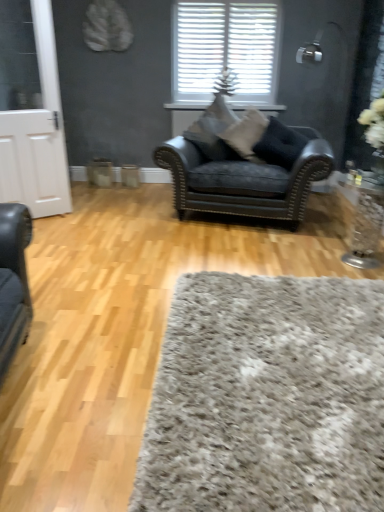
Where is `suede-like gray pillow at center, which is counted as the third pillow, starting from the right`? This screenshot has height=512, width=384. suede-like gray pillow at center, which is counted as the third pillow, starting from the right is located at coordinates (213, 130).

Identify the location of white textured blinds at upper center. The image size is (384, 512). (225, 48).

Identify the location of light brown wood flooring at center. (120, 332).

Locate an element on the screen. The width and height of the screenshot is (384, 512). suede-like gray pillow at center, which is counted as the third pillow, starting from the right is located at coordinates (213, 130).

From a real-world perspective, relative to white textured blinds at upper center, is suede-like beige pillow at center, which ranks as the second pillow in left-to-right order, vertically above or below?

suede-like beige pillow at center, which ranks as the second pillow in left-to-right order, is situated lower than white textured blinds at upper center in the real world.

Image resolution: width=384 pixels, height=512 pixels. In order to click on window to the left of suede-like beige pillow at center, which ranks as the second pillow in left-to-right order in this screenshot , I will do `click(225, 48)`.

Does suede-like beige pillow at center, which ranks as the second pillow in left-to-right order, touch white textured blinds at upper center?

No, suede-like beige pillow at center, which ranks as the second pillow in left-to-right order, is not touching white textured blinds at upper center.

Which of these two, suede-like beige pillow at center, marked as the 2th pillow in a right-to-left arrangement, or white textured blinds at upper center, is wider?

suede-like beige pillow at center, marked as the 2th pillow in a right-to-left arrangement, is wider.

Which of these two, suede-like beige pillow at center, which ranks as the second pillow in left-to-right order, or clear glass vase at right, is wider?

With larger width is suede-like beige pillow at center, which ranks as the second pillow in left-to-right order.

From the image's perspective, does suede-like beige pillow at center, which ranks as the second pillow in left-to-right order, appear lower than clear glass vase at right?

Incorrect, from the image's perspective, suede-like beige pillow at center, which ranks as the second pillow in left-to-right order, is higher than clear glass vase at right.

Are suede-like beige pillow at center, marked as the 2th pillow in a right-to-left arrangement, and clear glass vase at right located far from each other?

Yes, suede-like beige pillow at center, marked as the 2th pillow in a right-to-left arrangement, and clear glass vase at right are located far from each other.

Based on the photo, how much distance is there between suede-like beige pillow at center, which ranks as the second pillow in left-to-right order, and clear glass vase at right?

suede-like beige pillow at center, which ranks as the second pillow in left-to-right order, and clear glass vase at right are 3.79 feet apart.

Is velvet black armchair at center not near black leather pillow at center, placed as the 3th pillow when sorted from left to right?

No, velvet black armchair at center is in close proximity to black leather pillow at center, placed as the 3th pillow when sorted from left to right.

Between velvet black armchair at center and black leather pillow at center, placed as the 3th pillow when sorted from left to right, which one is positioned in front?

velvet black armchair at center is in front.

This screenshot has height=512, width=384. I want to click on chair below the black leather pillow at center, the 1th pillow in the right-to-left sequence (from a real-world perspective), so click(240, 170).

Is black leather pillow at center, placed as the 3th pillow when sorted from left to right, positioned behind suede-like beige pillow at center, marked as the 2th pillow in a right-to-left arrangement?

No, it is in front of suede-like beige pillow at center, marked as the 2th pillow in a right-to-left arrangement.

Which object is positioned more to the right, black leather pillow at center, the 1th pillow in the right-to-left sequence, or suede-like beige pillow at center, which ranks as the second pillow in left-to-right order?

Positioned to the right is black leather pillow at center, the 1th pillow in the right-to-left sequence.

This screenshot has height=512, width=384. In order to click on pillow that is the 1st object to the left of the black leather pillow at center, the 1th pillow in the right-to-left sequence, starting at the anchor in this screenshot , I will do `click(246, 134)`.

Which is more to the left, light brown wood flooring at center or clear glass vase at right?

light brown wood flooring at center is more to the left.

Between point (130, 317) and point (365, 234), which one is positioned in front?

The point (130, 317) is closer to the camera.

Is light brown wood flooring at center thinner than clear glass vase at right?

No, light brown wood flooring at center is not thinner than clear glass vase at right.

The width and height of the screenshot is (384, 512). I want to click on chair that appears on the left of suede-like beige pillow at center, marked as the 2th pillow in a right-to-left arrangement, so click(x=240, y=170).

Is suede-like beige pillow at center, marked as the 2th pillow in a right-to-left arrangement, positioned beyond the bounds of velvet black armchair at center?

No.

Is suede-like beige pillow at center, marked as the 2th pillow in a right-to-left arrangement, aimed at velvet black armchair at center?

Yes.

Considering the positions of points (246, 110) and (255, 190), is point (246, 110) closer to camera compared to point (255, 190)?

No.

From the image's perspective, is shaggy gray rug at lower center above suede-like gray pillow at center, which is counted as the third pillow, starting from the right?

No, from the image's perspective, shaggy gray rug at lower center is not over suede-like gray pillow at center, which is counted as the third pillow, starting from the right.

Is point (319, 374) less distant than point (231, 152)?

That is True.

Could suede-like gray pillow at center, which is the 1th pillow in left-to-right order, be considered to be inside shaggy gray rug at lower center?

That's incorrect, suede-like gray pillow at center, which is the 1th pillow in left-to-right order, is not inside shaggy gray rug at lower center.

Is the position of shaggy gray rug at lower center less distant than that of suede-like gray pillow at center, which is counted as the third pillow, starting from the right?

Yes, shaggy gray rug at lower center is in front of suede-like gray pillow at center, which is counted as the third pillow, starting from the right.

The height and width of the screenshot is (512, 384). I want to click on window behind the suede-like beige pillow at center, which ranks as the second pillow in left-to-right order, so click(225, 48).

Which pillow is the 2nd one when counting from the left side of the clear glass vase at right? Please provide its 2D coordinates.

[(246, 134)]

Based on the photo, estimate the real-world distances between objects in this image. Which object is further from suede-like beige pillow at center, marked as the 2th pillow in a right-to-left arrangement, clear glass vase at right or light brown wood flooring at center?

light brown wood flooring at center lies further to suede-like beige pillow at center, marked as the 2th pillow in a right-to-left arrangement, than the other object.

When comparing their distances from shaggy gray rug at lower center, does black leather pillow at center, the 1th pillow in the right-to-left sequence, or suede-like beige pillow at center, marked as the 2th pillow in a right-to-left arrangement, seem closer?

black leather pillow at center, the 1th pillow in the right-to-left sequence, is positioned closer to the anchor shaggy gray rug at lower center.

Which object lies nearer to the anchor point velvet black armchair at center, clear glass vase at right or black leather pillow at center, placed as the 3th pillow when sorted from left to right?

Among the two, black leather pillow at center, placed as the 3th pillow when sorted from left to right, is located nearer to velvet black armchair at center.

When comparing their distances from white textured blinds at upper center, does clear glass vase at right or suede-like gray pillow at center, which is the 1th pillow in left-to-right order, seem further?

Among the two, clear glass vase at right is located further to white textured blinds at upper center.

Looking at this image, looking at the image, which one is located closer to suede-like beige pillow at center, which ranks as the second pillow in left-to-right order, suede-like gray pillow at center, which is the 1th pillow in left-to-right order, or clear glass vase at right?

suede-like gray pillow at center, which is the 1th pillow in left-to-right order.

Estimate the real-world distances between objects in this image. Which object is closer to light brown wood flooring at center, suede-like gray pillow at center, which is the 1th pillow in left-to-right order, or clear glass vase at right?

clear glass vase at right is positioned closer to the anchor light brown wood flooring at center.

Considering their positions, is velvet black armchair at center positioned closer to black leather pillow at center, the 1th pillow in the right-to-left sequence, than white textured blinds at upper center?

velvet black armchair at center is positioned closer to the anchor black leather pillow at center, the 1th pillow in the right-to-left sequence.

Estimate the real-world distances between objects in this image. Which object is further from shaggy gray rug at lower center, white textured blinds at upper center or clear glass vase at right?

Among the two, white textured blinds at upper center is located further to shaggy gray rug at lower center.

I want to click on pillow between clear glass vase at right and suede-like beige pillow at center, marked as the 2th pillow in a right-to-left arrangement, along the z-axis, so click(280, 144).

This screenshot has width=384, height=512. I want to click on pillow located between light brown wood flooring at center and suede-like beige pillow at center, which ranks as the second pillow in left-to-right order, in the depth direction, so click(280, 144).

I want to click on hardwood between shaggy gray rug at lower center and suede-like beige pillow at center, marked as the 2th pillow in a right-to-left arrangement, in the front-back direction, so click(120, 332).

Identify the location of pillow located between velvet black armchair at center and suede-like beige pillow at center, marked as the 2th pillow in a right-to-left arrangement, in the depth direction. (280, 144).